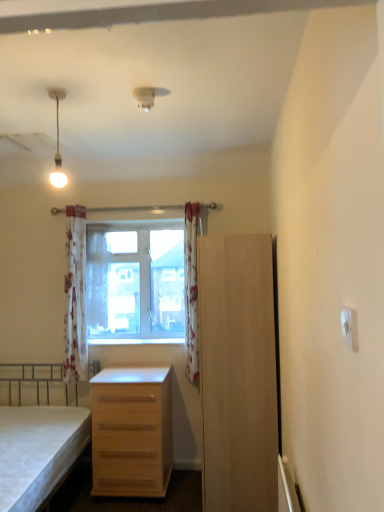
This screenshot has height=512, width=384. I want to click on light wood drawer at center, so click(131, 439).

The width and height of the screenshot is (384, 512). What are the coordinates of `white floral fabric curtain at center, which ranks as the second curtain in right-to-left order` in the screenshot? It's located at [97, 281].

The width and height of the screenshot is (384, 512). I want to click on white matte bed at lower left, so pyautogui.click(x=38, y=434).

The image size is (384, 512). Find the location of `white glossy lamp at upper left`. white glossy lamp at upper left is located at coordinates 57,142.

This screenshot has height=512, width=384. Describe the element at coordinates (135, 280) in the screenshot. I see `transparent glass window at center` at that location.

Measure the distance between transparent glass window at center and camera.

transparent glass window at center and camera are 11.42 feet apart.

The width and height of the screenshot is (384, 512). I want to click on light wood drawer at center, so click(131, 439).

Looking at this image, is white matte bed at lower left smaller than white floral fabric curtain at center, the second curtain when ordered from left to right?

Actually, white matte bed at lower left might be larger than white floral fabric curtain at center, the second curtain when ordered from left to right.

Looking at this image, from the image's perspective, is white matte bed at lower left above white floral fabric curtain at center, the second curtain when ordered from left to right?

Incorrect, from the image's perspective, white matte bed at lower left is lower than white floral fabric curtain at center, the second curtain when ordered from left to right.

Considering the relative positions of white matte bed at lower left and white floral fabric curtain at center, the second curtain when ordered from left to right, in the image provided, is white matte bed at lower left to the left or to the right of white floral fabric curtain at center, the second curtain when ordered from left to right,?

Based on their positions, white matte bed at lower left is located to the left of white floral fabric curtain at center, the second curtain when ordered from left to right.

Considering the relative positions of white glossy lamp at upper left and light wood cabinet at right in the image provided, is white glossy lamp at upper left to the left or to the right of light wood cabinet at right?

From the image, it's evident that white glossy lamp at upper left is to the left of light wood cabinet at right.

Between white glossy lamp at upper left and light wood cabinet at right, which one is positioned behind?

light wood cabinet at right is behind.

From a real-world perspective, is white glossy lamp at upper left over light wood cabinet at right?

Indeed, from a real-world perspective, white glossy lamp at upper left stands above light wood cabinet at right.

This screenshot has height=512, width=384. In order to click on window screen positioned vertically above the light wood drawer at center (from a real-world perspective) in this screenshot , I will do `click(135, 280)`.

Can you confirm if transparent glass window at center is shorter than light wood drawer at center?

In fact, transparent glass window at center may be taller than light wood drawer at center.

Is transparent glass window at center next to light wood drawer at center?

transparent glass window at center is not next to light wood drawer at center, and they're not touching.

Is transparent glass window at center bigger than light wood drawer at center?

No, transparent glass window at center is not bigger than light wood drawer at center.

Considering the sizes of objects white floral fabric curtain at center, the second curtain when ordered from left to right, and transparent glass window at center in the image provided, who is wider, white floral fabric curtain at center, the second curtain when ordered from left to right, or transparent glass window at center?

With larger width is white floral fabric curtain at center, the second curtain when ordered from left to right.

Is white floral fabric curtain at center, the second curtain when ordered from left to right, turned away from transparent glass window at center?

Yes, white floral fabric curtain at center, the second curtain when ordered from left to right, is positioned with its back facing transparent glass window at center.

Is white floral fabric curtain at center, the second curtain when ordered from left to right, in front of transparent glass window at center?

That is True.

At what (x,y) coordinates should I click in order to perform the action: click on window screen below the white floral fabric curtain at center, the second curtain when ordered from left to right (from a real-world perspective). Please return your answer as a coordinate pair (x, y). Looking at the image, I should click on (x=135, y=280).

Consider the image. Considering the relative sizes of light wood cabinet at right and white floral fabric curtain at center, which ranks as the second curtain in right-to-left order, in the image provided, is light wood cabinet at right wider than white floral fabric curtain at center, which ranks as the second curtain in right-to-left order,?

Indeed, light wood cabinet at right has a greater width compared to white floral fabric curtain at center, which ranks as the second curtain in right-to-left order.

Where is `cabinetry that is on the right side of white floral fabric curtain at center, which ranks as the second curtain in right-to-left order`? This screenshot has width=384, height=512. cabinetry that is on the right side of white floral fabric curtain at center, which ranks as the second curtain in right-to-left order is located at coordinates (237, 373).

In the scene shown: Considering the sizes of objects light wood cabinet at right and white floral fabric curtain at center, the second curtain when ordered from left to right, in the image provided, who is shorter, light wood cabinet at right or white floral fabric curtain at center, the second curtain when ordered from left to right,?

white floral fabric curtain at center, the second curtain when ordered from left to right, is shorter.

Is light wood cabinet at right in front of or behind white floral fabric curtain at center, which ranks as the second curtain in right-to-left order, in the image?

Clearly, light wood cabinet at right is in front of white floral fabric curtain at center, which ranks as the second curtain in right-to-left order.

Considering the positions of objects white glossy lamp at upper left and light wood drawer at center in the image provided, who is more to the right, white glossy lamp at upper left or light wood drawer at center?

light wood drawer at center is more to the right.

Who is bigger, white glossy lamp at upper left or light wood drawer at center?

Bigger between the two is light wood drawer at center.

Can you confirm if white glossy lamp at upper left is taller than light wood drawer at center?

No, white glossy lamp at upper left is not taller than light wood drawer at center.

From a real-world perspective, is floral fabric curtain at center, marked as the third curtain in a left-to-right arrangement, located beneath light wood drawer at center?

No, from a real-world perspective, floral fabric curtain at center, marked as the third curtain in a left-to-right arrangement, is not below light wood drawer at center.

Does floral fabric curtain at center, marked as the third curtain in a left-to-right arrangement, have a greater width compared to light wood drawer at center?

In fact, floral fabric curtain at center, marked as the third curtain in a left-to-right arrangement, might be narrower than light wood drawer at center.

Which of these two, floral fabric curtain at center, which is counted as the 1th curtain, starting from the right, or light wood drawer at center, stands shorter?

light wood drawer at center.

Identify the location of the 2nd curtain counting from the right of the white matte bed at lower left. (97, 281).

The height and width of the screenshot is (512, 384). Identify the location of cabinetry below the white glossy lamp at upper left (from the image's perspective). (237, 373).

From the image, which object appears to be nearer to white wood at center, light wood cabinet at right or floral fabric curtain at center, marked as the third curtain in a left-to-right arrangement?

Among the two, floral fabric curtain at center, marked as the third curtain in a left-to-right arrangement, is located nearer to white wood at center.

Looking at this image, based on their spatial positions, is transparent glass window at center or white matte bed at lower left closer to white floral fabric curtain at center, which ranks as the second curtain in right-to-left order?

transparent glass window at center lies closer to white floral fabric curtain at center, which ranks as the second curtain in right-to-left order, than the other object.

Which object lies further to the anchor point white matte bed at lower left, light wood drawer at center or white glossy lamp at upper left?

white glossy lamp at upper left is positioned further to the anchor white matte bed at lower left.

Considering their positions, is white glossy lamp at upper left positioned closer to floral fabric curtain at center, marked as the third curtain in a left-to-right arrangement, than white wood at center?

The object closer to floral fabric curtain at center, marked as the third curtain in a left-to-right arrangement, is white wood at center.

Considering their positions, is light wood drawer at center positioned closer to white floral fabric curtain at center, which ranks as the second curtain in right-to-left order, than floral fabric curtain at center, marked as the third curtain in a left-to-right arrangement?

The object closer to white floral fabric curtain at center, which ranks as the second curtain in right-to-left order, is light wood drawer at center.

When comparing their distances from white wood at center, does floral fabric curtain at center, the 3th curtain positioned from the right, or white floral fabric curtain at center, the second curtain when ordered from left to right, seem closer?

Among the two, white floral fabric curtain at center, the second curtain when ordered from left to right, is located nearer to white wood at center.

From the image, which object appears to be farther from light wood drawer at center, light wood cabinet at right or white plastic smoke detector at upper center?

The object further to light wood drawer at center is white plastic smoke detector at upper center.

When comparing their distances from light wood cabinet at right, does white glossy lamp at upper left or light wood drawer at center seem further?

white glossy lamp at upper left is positioned further to the anchor light wood cabinet at right.

Where is `window screen between white plastic smoke detector at upper center and white matte bed at lower left from top to bottom`? Image resolution: width=384 pixels, height=512 pixels. window screen between white plastic smoke detector at upper center and white matte bed at lower left from top to bottom is located at coordinates (135, 280).

Where is `lamp between white plastic smoke detector at upper center and light wood drawer at center in the vertical direction`? This screenshot has width=384, height=512. lamp between white plastic smoke detector at upper center and light wood drawer at center in the vertical direction is located at coordinates pyautogui.click(x=57, y=142).

Identify the location of window screen that lies between white floral fabric curtain at center, which ranks as the second curtain in right-to-left order, and light wood drawer at center from top to bottom. (135, 280).

Locate an element on the screen. Image resolution: width=384 pixels, height=512 pixels. drawer between white matte bed at lower left and white wood at center from front to back is located at coordinates (x=131, y=439).